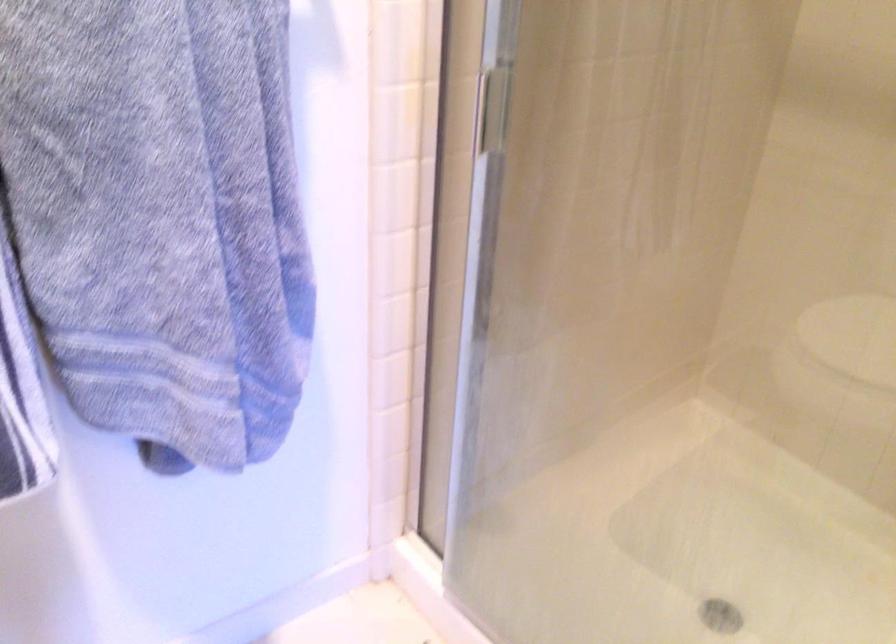
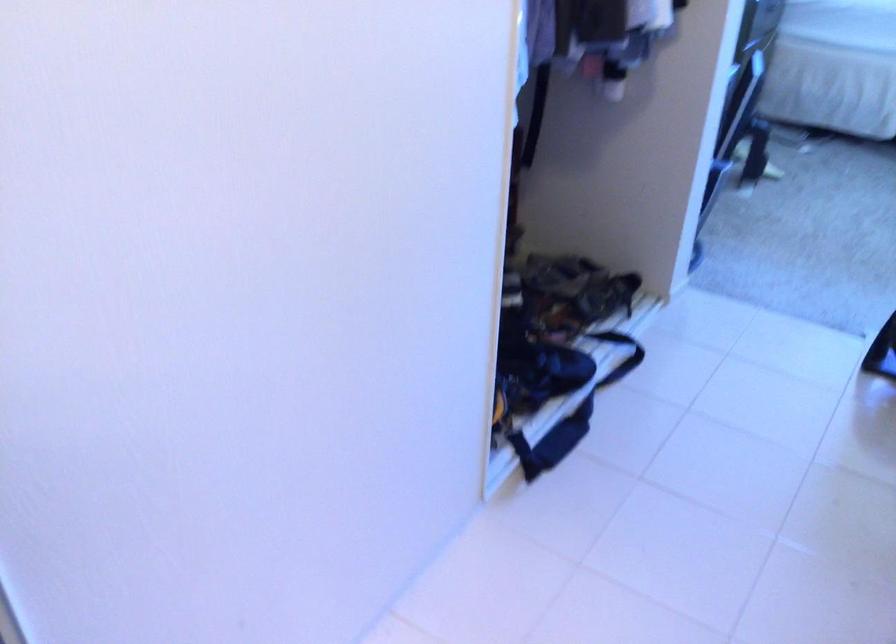
The images are taken continuously from a first-person perspective. In which direction is your viewpoint rotating?

The camera rotated toward right-down.